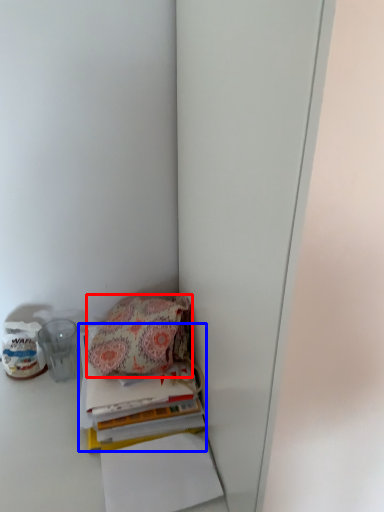
Question: Among these objects, which one is nearest to the camera, handbag (highlighted by a red box) or paperback book (highlighted by a blue box)?

Choices:
 (A) handbag
 (B) paperback book

Answer: (B)